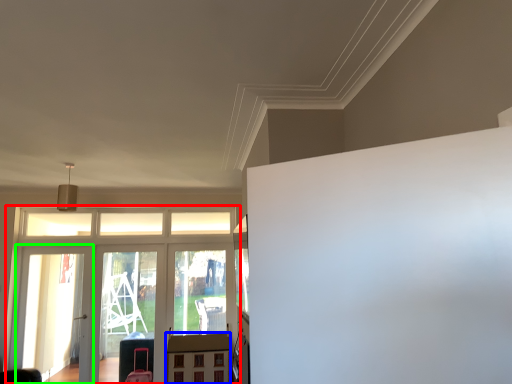
Question: Considering the real-world distances, which object is closest to elevator (highlighted by a red box)? table (highlighted by a blue box) or screen door (highlighted by a green box).

Choices:
 (A) table
 (B) screen door

Answer: (B)